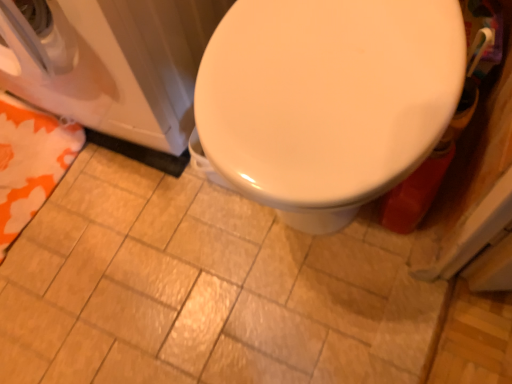
Measure the distance between orange fabric towel at lower left and camera.

They are 3.32 feet apart.

Locate an element on the screen. This screenshot has width=512, height=384. white glossy washer at left is located at coordinates (110, 62).

Is white glossy washer at left oriented towards orange fabric towel at lower left?

Yes.

Can you confirm if white glossy washer at left is shorter than orange fabric towel at lower left?

In fact, white glossy washer at left may be taller than orange fabric towel at lower left.

Would you say white glossy washer at left is inside or outside orange fabric towel at lower left?

white glossy washer at left cannot be found inside orange fabric towel at lower left.

Is point (36, 24) closer or farther from the camera than point (3, 151)?

Point (36, 24) appears to be closer to the viewer than point (3, 151).

Locate an element on the screen. This screenshot has width=512, height=384. ceramic tile located underneath the white glossy washer at left (from a real-world perspective) is located at coordinates (203, 289).

Which is more to the left, white glossy washer at left or matte ceramic tile at center?

white glossy washer at left.

From a real-world perspective, relative to matte ceramic tile at center, is white glossy washer at left vertically above or below?

In terms of real-world spatial position, white glossy washer at left is above matte ceramic tile at center.

Which object is closer to the camera, matte ceramic tile at center or orange fabric towel at lower left?

matte ceramic tile at center is closer to the camera.

Where is `beach towel behind the matte ceramic tile at center`? beach towel behind the matte ceramic tile at center is located at coordinates (30, 162).

From the picture: Is the surface of matte ceramic tile at center in direct contact with orange fabric towel at lower left?

No, matte ceramic tile at center is not next to orange fabric towel at lower left.

From the image's perspective, is matte ceramic tile at center positioned above or below orange fabric towel at lower left?

matte ceramic tile at center is below orange fabric towel at lower left.

Is the depth of orange fabric towel at lower left less than that of matte ceramic tile at center?

No, orange fabric towel at lower left is behind matte ceramic tile at center.

From the image's perspective, which object appears higher, orange fabric towel at lower left or matte ceramic tile at center?

orange fabric towel at lower left appears higher in the image.

Based on the photo, is matte ceramic tile at center at the back of orange fabric towel at lower left?

No, orange fabric towel at lower left is not facing the opposite direction of matte ceramic tile at center.

Is orange fabric towel at lower left wider than matte ceramic tile at center?

In fact, orange fabric towel at lower left might be narrower than matte ceramic tile at center.

Which object is positioned more to the left, matte ceramic tile at center or white glossy washer at left?

Positioned to the left is white glossy washer at left.

Who is bigger, matte ceramic tile at center or white glossy washer at left?

white glossy washer at left is bigger.

Are matte ceramic tile at center and white glossy washer at left far apart?

No, matte ceramic tile at center is not far from white glossy washer at left.

Which is more to the left, orange fabric towel at lower left or white glossy washer at left?

Positioned to the left is orange fabric towel at lower left.

Based on the photo, does orange fabric towel at lower left turn towards white glossy washer at left?

No, orange fabric towel at lower left is not turned towards white glossy washer at left.

Identify the location of washer above the orange fabric towel at lower left (from the image's perspective). The image size is (512, 384). (110, 62).

Identify the location of washer on the left of matte ceramic tile at center. The image size is (512, 384). (110, 62).

Which object lies nearer to the anchor point orange fabric towel at lower left, white glossy washer at left or matte ceramic tile at center?

white glossy washer at left is positioned closer to the anchor orange fabric towel at lower left.

Which object lies nearer to the anchor point white glossy washer at left, matte ceramic tile at center or orange fabric towel at lower left?

orange fabric towel at lower left is closer to white glossy washer at left.

Based on their spatial positions, is orange fabric towel at lower left or white glossy washer at left further from matte ceramic tile at center?

Among the two, white glossy washer at left is located further to matte ceramic tile at center.

Considering their positions, is matte ceramic tile at center positioned closer to orange fabric towel at lower left than white glossy washer at left?

white glossy washer at left.

Estimate the real-world distances between objects in this image. Which object is closer to matte ceramic tile at center, white glossy washer at left or orange fabric towel at lower left?

orange fabric towel at lower left lies closer to matte ceramic tile at center than the other object.

Which object lies further to the anchor point white glossy washer at left, orange fabric towel at lower left or matte ceramic tile at center?

matte ceramic tile at center is positioned further to the anchor white glossy washer at left.

I want to click on beach towel that lies between white glossy washer at left and matte ceramic tile at center from top to bottom, so click(x=30, y=162).